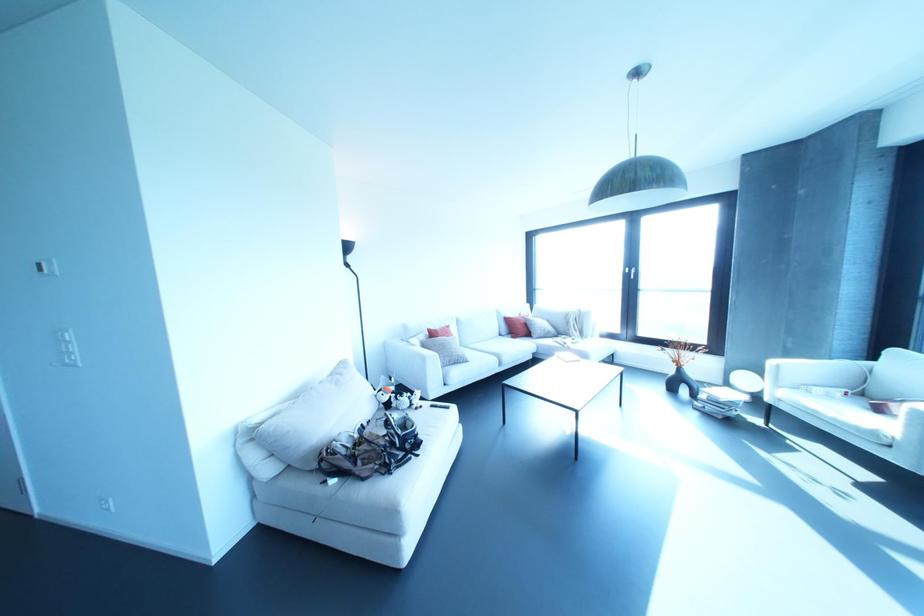
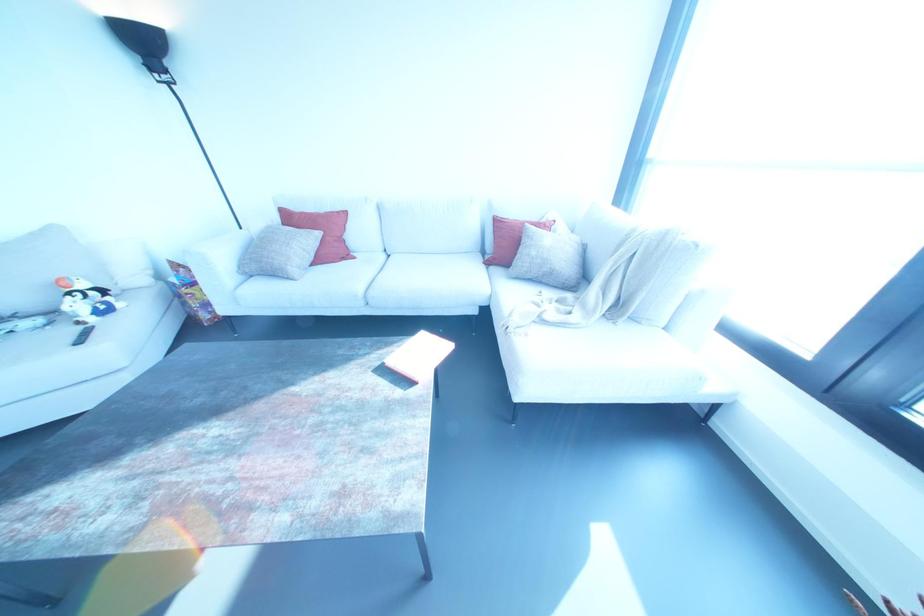
In the second image, find the point that corresponds to (x=431, y=333) in the first image.

(286, 217)